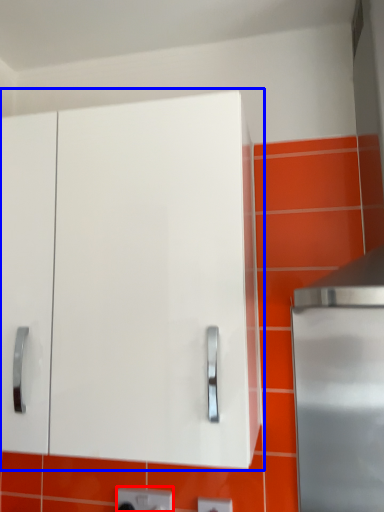
Question: Which point is further to the camera, electric outlet (highlighted by a red box) or cabinetry (highlighted by a blue box)?

Choices:
 (A) electric outlet
 (B) cabinetry

Answer: (A)